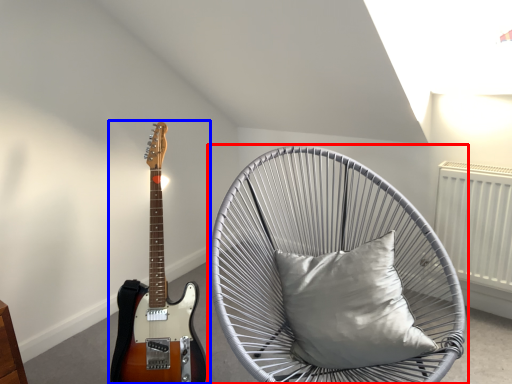
Question: Which object is closer to the camera taking this photo, chair (highlighted by a red box) or guitar (highlighted by a blue box)?

Choices:
 (A) chair
 (B) guitar

Answer: (A)